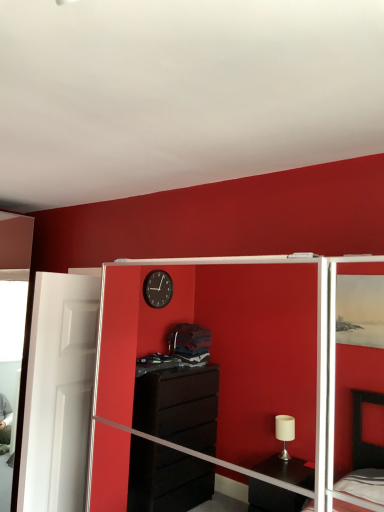
Question: Should I look upward or downward to see white glossy door at left?

Choices:
 (A) up
 (B) down

Answer: (B)